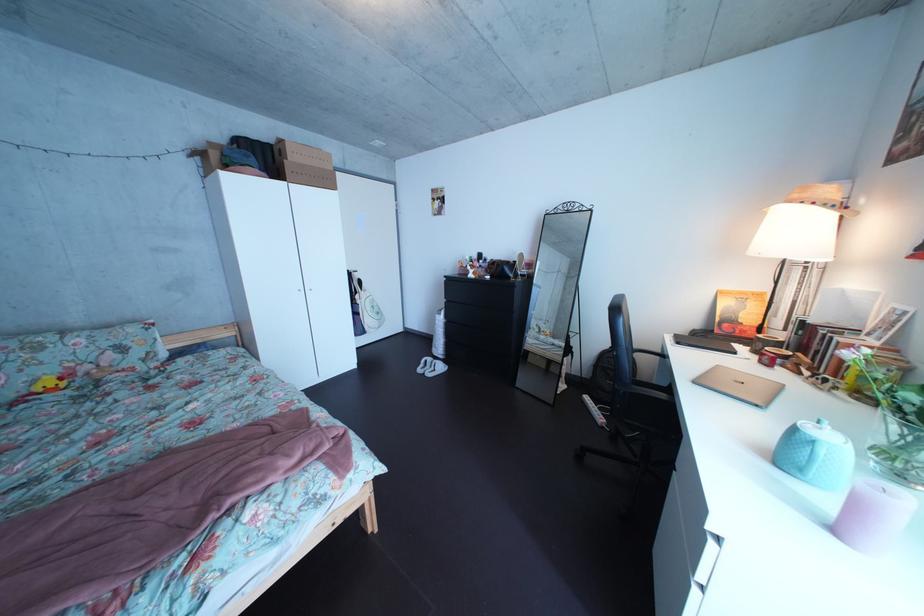
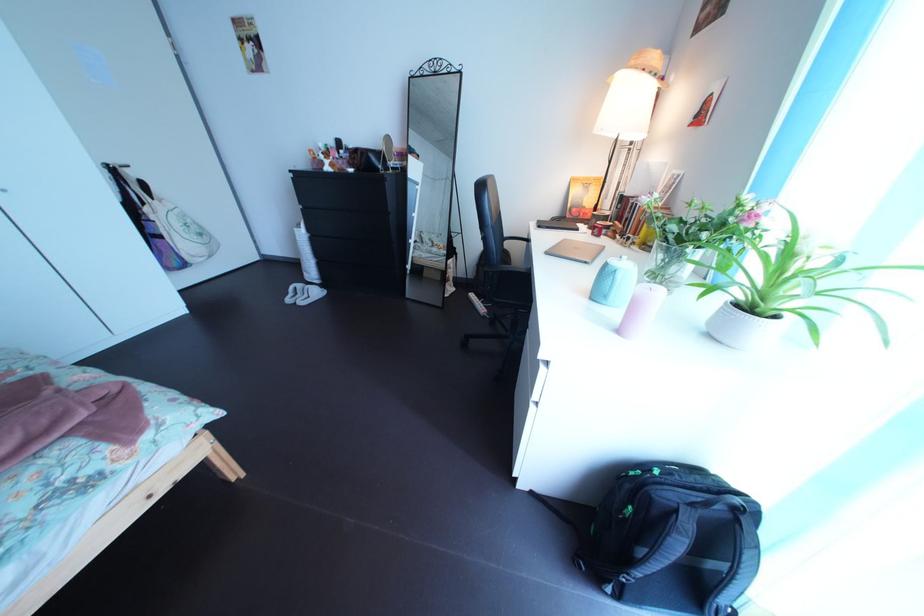
In the second image, find the point that corresponds to [391,317] in the first image.

(209, 237)